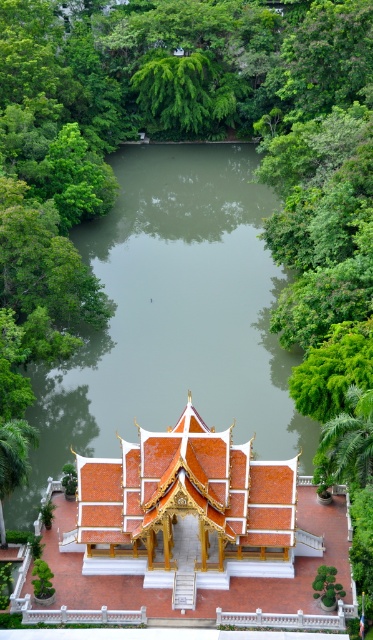
Question: Can you confirm if green water at center is positioned to the left of shiny orange roof at center?

Choices:
 (A) no
 (B) yes

Answer: (B)

Question: Which point is closer to the camera?

Choices:
 (A) (126, 609)
 (B) (127, 243)

Answer: (A)

Question: Can you confirm if green water at center is positioned below shiny orange roof at center?

Choices:
 (A) yes
 (B) no

Answer: (B)

Question: Which of the following is the closest to the observer?

Choices:
 (A) shiny orange roof at center
 (B) green water at center

Answer: (A)

Question: Is green water at center to the left of shiny orange roof at center from the viewer's perspective?

Choices:
 (A) yes
 (B) no

Answer: (A)

Question: Which point is farther to the camera?

Choices:
 (A) (258, 371)
 (B) (196, 532)

Answer: (A)